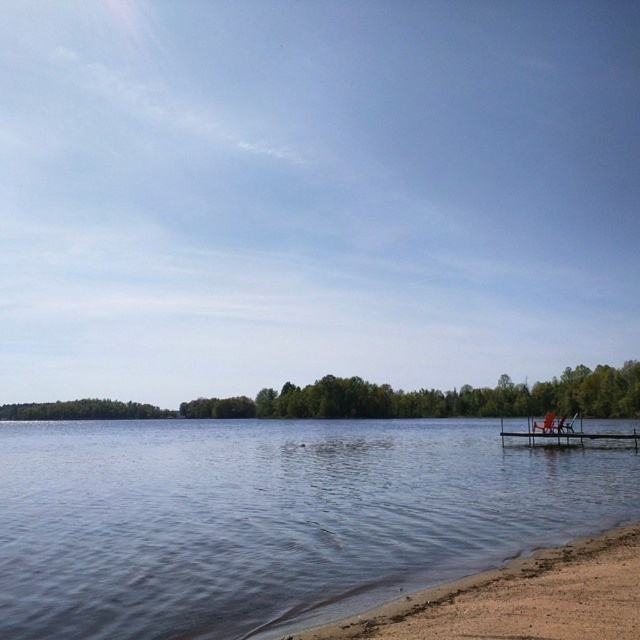
Question: Which object is positioned closest to the brown sandy beach at lower right?

Choices:
 (A) clear water at lower left
 (B) wooden chair at lower right
 (C) brown wooden dock at lower right

Answer: (A)

Question: Does brown sandy beach at lower right have a larger size compared to brown wooden dock at lower right?

Choices:
 (A) no
 (B) yes

Answer: (A)

Question: Does clear water at lower left have a smaller size compared to brown wooden dock at lower right?

Choices:
 (A) yes
 (B) no

Answer: (B)

Question: Which point is farther from the camera taking this photo?

Choices:
 (A) (269, 477)
 (B) (556, 435)
 (C) (554, 428)
 (D) (541, 592)

Answer: (C)

Question: Which point is closer to the camera?

Choices:
 (A) (506, 436)
 (B) (552, 609)

Answer: (B)

Question: Does clear water at lower left have a greater width compared to brown sandy beach at lower right?

Choices:
 (A) yes
 (B) no

Answer: (A)